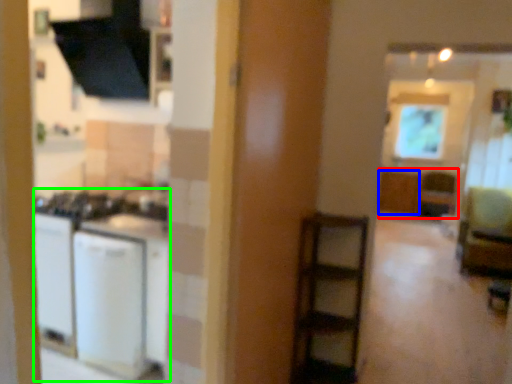
Question: Estimate the real-world distances between objects in this image. Which object is closer to cabinetry (highlighted by a red box), cabinetry (highlighted by a blue box) or appliance (highlighted by a green box)?

Choices:
 (A) cabinetry
 (B) appliance

Answer: (A)